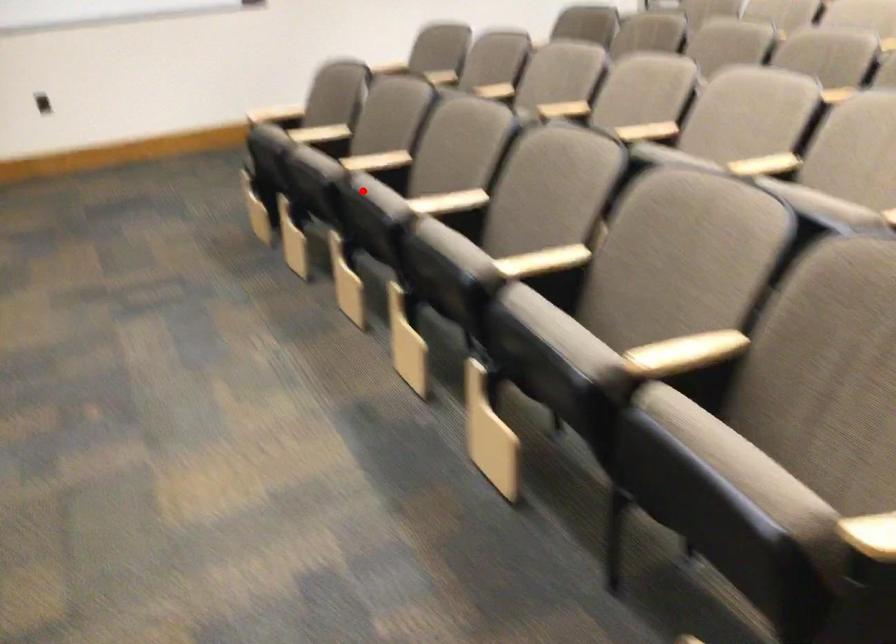
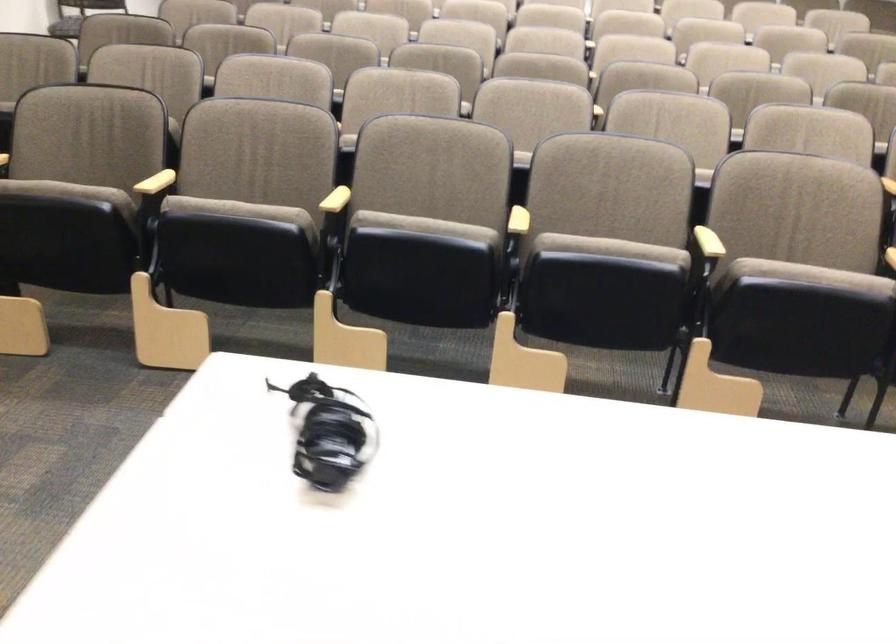
Question: I am providing you with two images of the same scene from different viewpoints. In image1, a red point is highlighted. Considering the same 3D point in image2, which of the following is correct?

Choices:
 (A) It is closer
 (B) It is farther

Answer: (A)